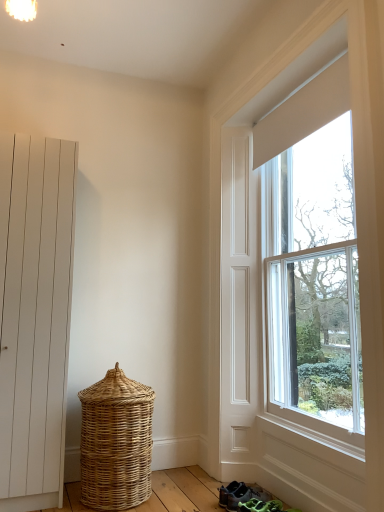
Question: From the image's perspective, is woven natural basket at lower left located above or below gray fabric sneakers at lower center?

Choices:
 (A) below
 (B) above

Answer: (B)

Question: From a real-world perspective, is woven natural basket at lower left above or below gray fabric sneakers at lower center?

Choices:
 (A) below
 (B) above

Answer: (B)

Question: Based on their relative distances, which object is farther from the clear glass window at right?

Choices:
 (A) woven natural basket at lower left
 (B) gray fabric sneakers at lower center
 (C) white matte door at left

Answer: (C)

Question: Estimate the real-world distances between objects in this image. Which object is farther from the gray fabric sneakers at lower center?

Choices:
 (A) white matte door at left
 (B) clear glass window at right
 (C) woven natural basket at lower left

Answer: (A)